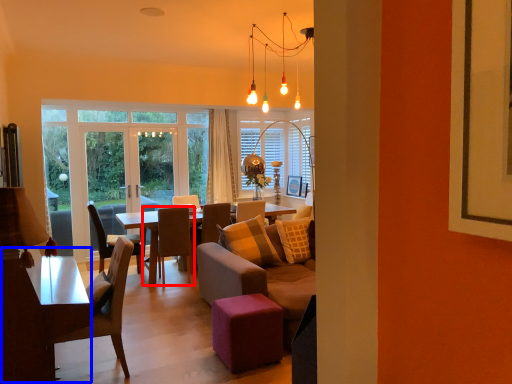
Question: Which point is closer to the camera, chair (highlighted by a red box) or table (highlighted by a blue box)?

Choices:
 (A) chair
 (B) table

Answer: (B)